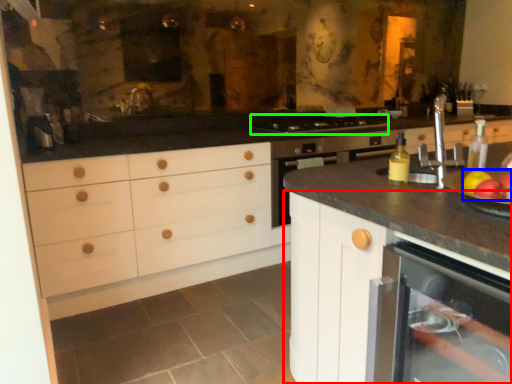
Question: Which is farther away from cabinetry (highlighted by a red box)? apple (highlighted by a blue box) or gas stove (highlighted by a green box)?

Choices:
 (A) apple
 (B) gas stove

Answer: (B)